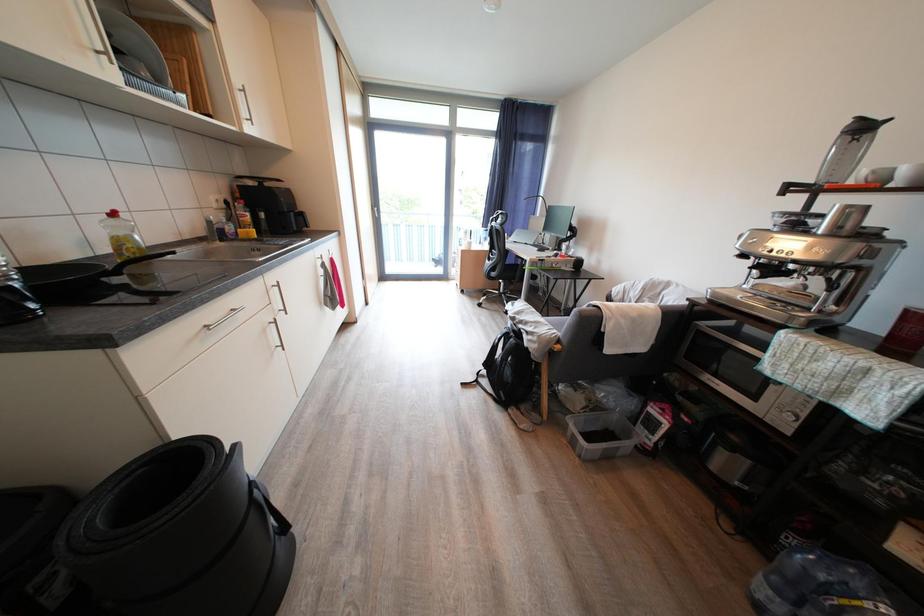
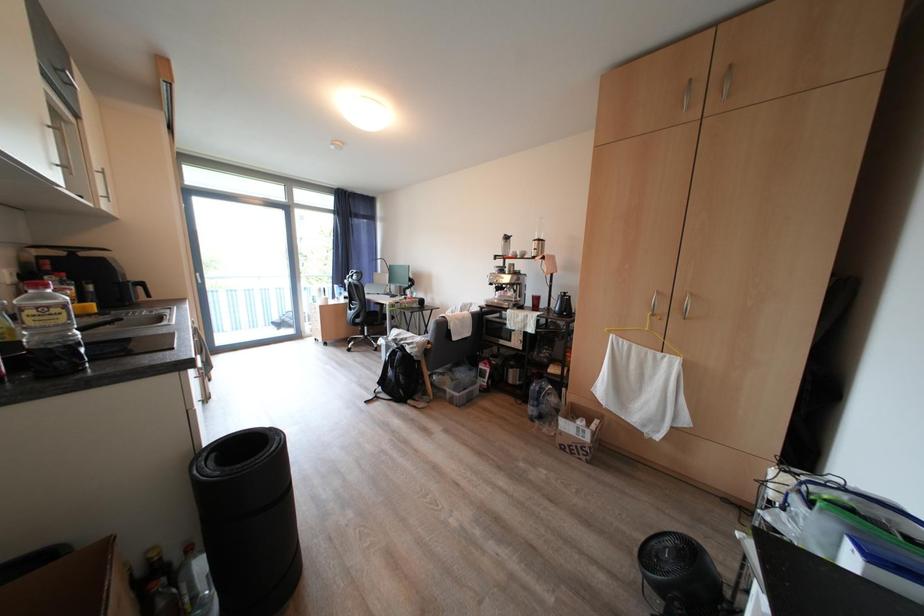
Question: The first image is from the beginning of the video and the second image is from the end. How did the camera likely rotate when shooting the video?

Choices:
 (A) Left
 (B) Right
 (C) Up
 (D) Down

Answer: (B)